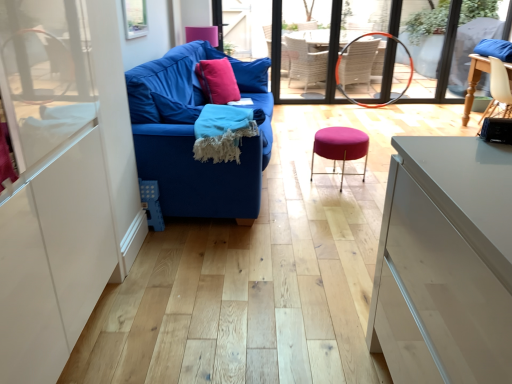
Question: Based on their sizes in the image, would you say matte wicker armchair at center is bigger or smaller than blue fabric couch at left?

Choices:
 (A) small
 (B) big

Answer: (A)

Question: Is matte wicker armchair at center spatially inside blue fabric couch at left, or outside of it?

Choices:
 (A) outside
 (B) inside

Answer: (A)

Question: Considering the real-world distances, which object is farthest from the pink fabric pillow at center?

Choices:
 (A) teal woven blanket at center
 (B) orange rubber hula hoop at center
 (C) matte wicker armchair at center
 (D) matte pink throw pillow at center
 (E) purple fabric stool at center

Answer: (C)

Question: Which object is positioned closest to the teal woven blanket at center?

Choices:
 (A) blue fabric couch at left
 (B) pink fabric pillow at center
 (C) matte pink throw pillow at center
 (D) orange rubber hula hoop at center
 (E) wooden chair at right

Answer: (A)